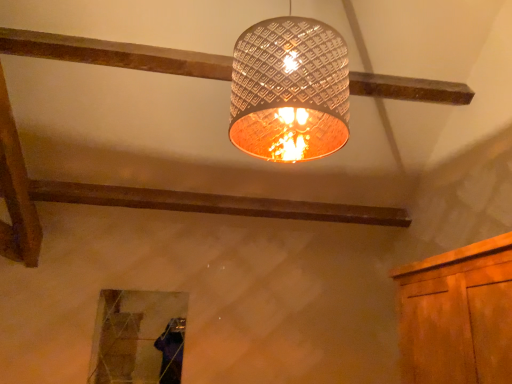
The image size is (512, 384). What do you see at coordinates (289, 90) in the screenshot?
I see `translucent white lampshade at center` at bounding box center [289, 90].

At what (x,y) coordinates should I click in order to perform the action: click on translucent white lampshade at center. Please return your answer as a coordinate pair (x, y). The height and width of the screenshot is (384, 512). Looking at the image, I should click on (289, 90).

Where is `translucent white lampshade at center`? The height and width of the screenshot is (384, 512). translucent white lampshade at center is located at coordinates (289, 90).